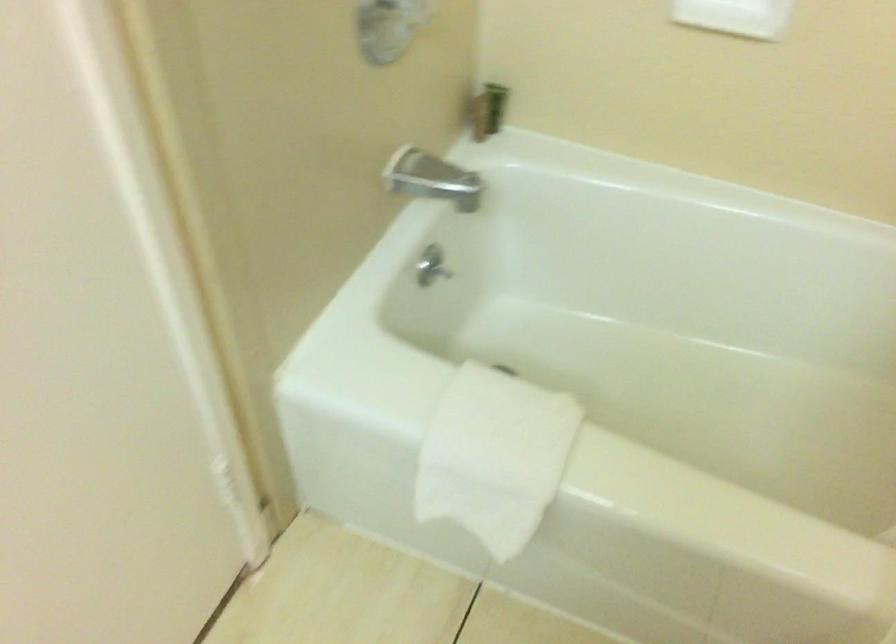
At what (x,y) coordinates should I click in order to perform the action: click on white towel. Please return your answer as a coordinate pair (x, y). This screenshot has width=896, height=644. Looking at the image, I should click on (494, 456).